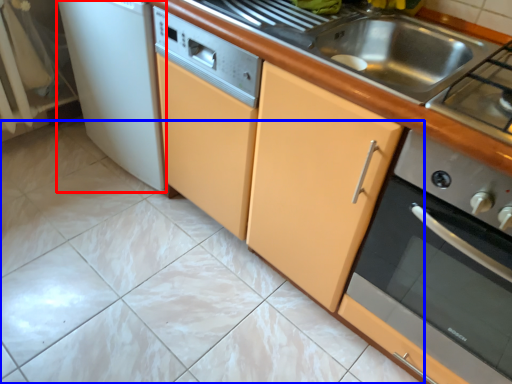
Question: Which of the following is the farthest to the observer, home appliance (highlighted by a red box) or ceramic tile (highlighted by a blue box)?

Choices:
 (A) home appliance
 (B) ceramic tile

Answer: (A)